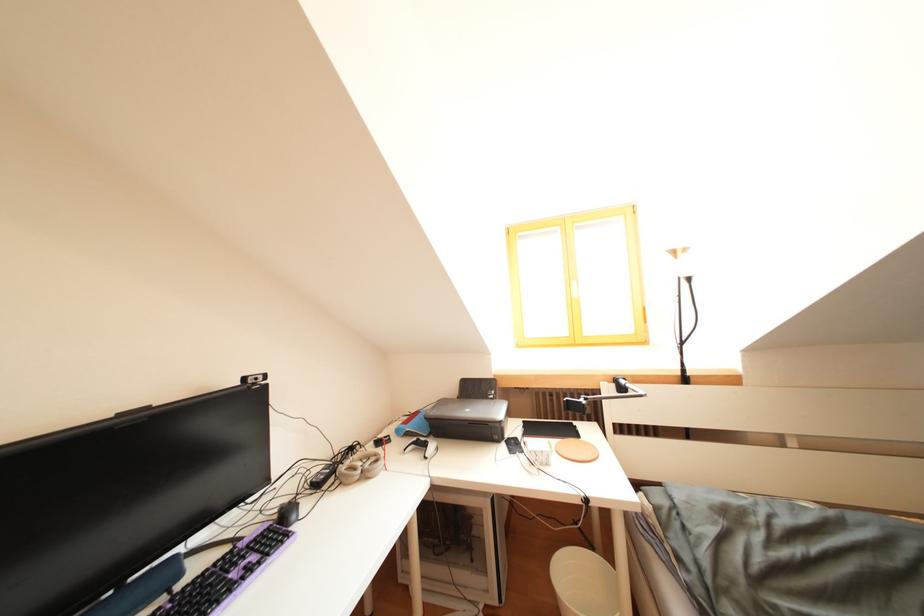
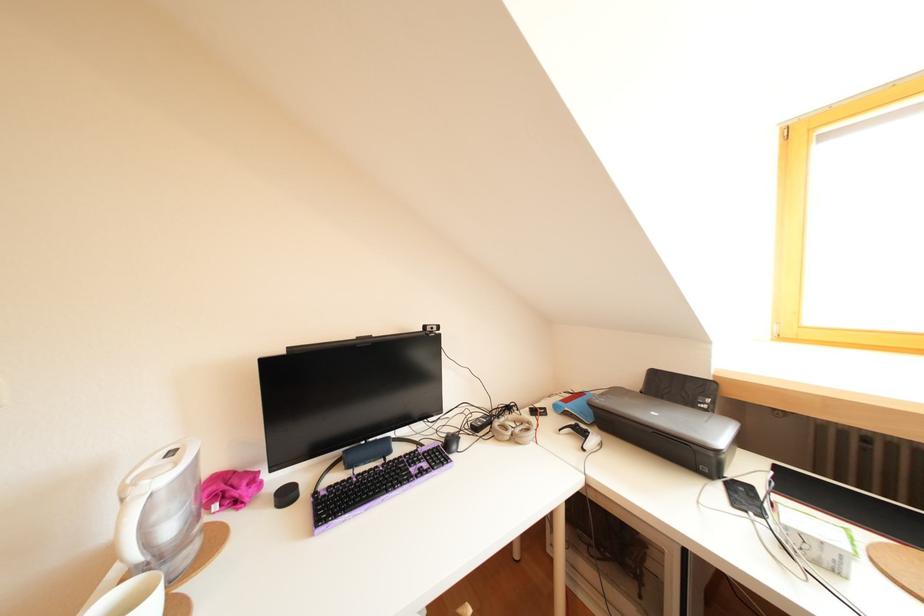
Question: The first image is from the beginning of the video and the second image is from the end. How did the camera likely rotate when shooting the video?

Choices:
 (A) Left
 (B) Right
 (C) Up
 (D) Down

Answer: (A)